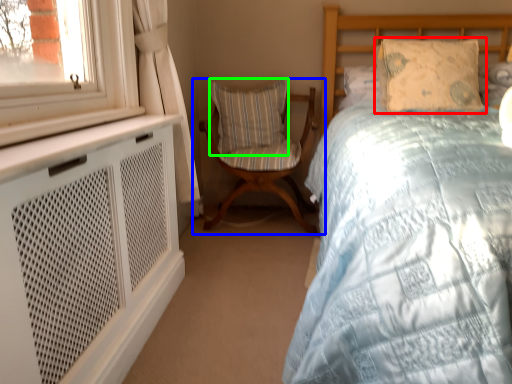
Question: Which object is positioned closest to pillow (highlighted by a red box)? Select from chair (highlighted by a blue box) and pillow (highlighted by a green box).

Choices:
 (A) chair
 (B) pillow

Answer: (A)